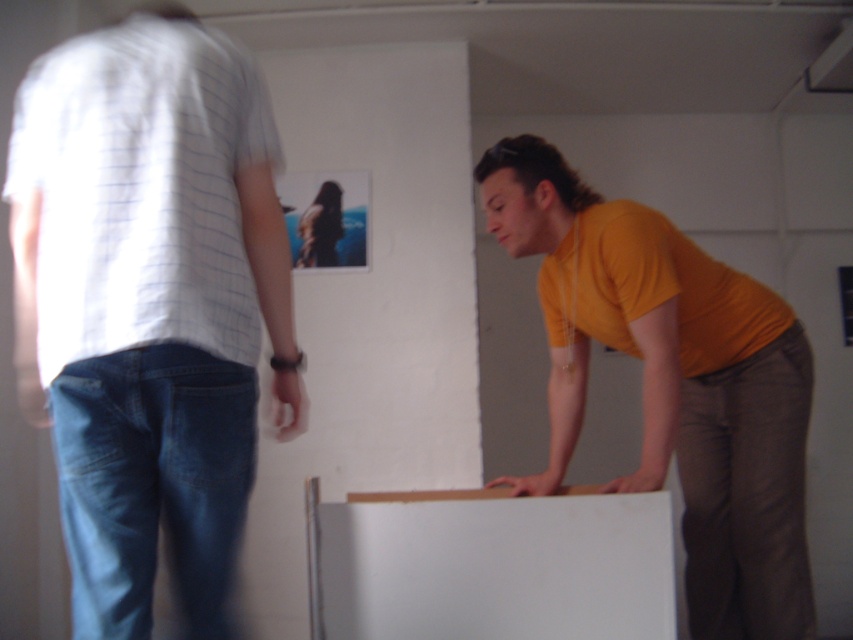
You are an art curator in the gallery. You need to adjust the lighting so that the matte yellow shirt at right and the smooth brown hair at upper center are both well lit. Which object should you focus the light on first to ensure both are properly illuminated?

The matte yellow shirt at right is closer to the viewer than the smooth brown hair at upper center, so you should focus the light on the matte yellow shirt at right first. This ensures that both objects are properly illuminated as the closer object will require adjustment before the one further away.

You are an art gallery assistant who needs to adjust the lighting for the framed photograph on the wall. You notice the matte white shirt at left and the smooth brown hair at upper center in the foreground. Which object should you focus on to ensure proper lighting for the framed photograph?

The smooth brown hair at upper center is located above the matte white shirt at left, so focusing on the smooth brown hair at upper center would help ensure proper lighting for the framed photograph since it is higher up.